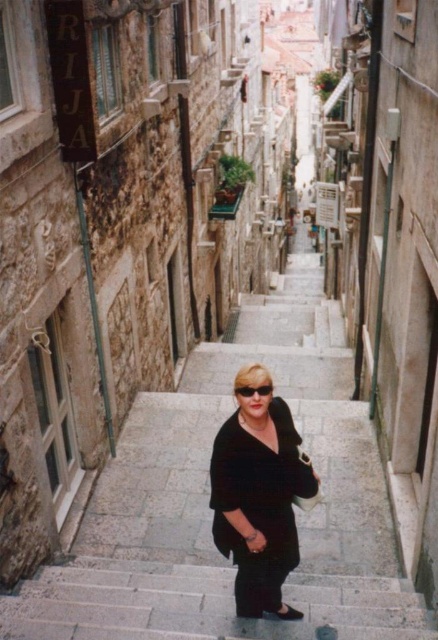
Between smooth stone stairs at center and black leather sandal at center, which one is positioned higher?

smooth stone stairs at center

Is smooth stone stairs at center below black leather sandal at center?

Incorrect, smooth stone stairs at center is not positioned below black leather sandal at center.

The height and width of the screenshot is (640, 438). I want to click on smooth stone stairs at center, so click(208, 500).

Who is positioned more to the right, black leather sandal at center or black matte sunglasses at center?

From the viewer's perspective, black leather sandal at center appears more on the right side.

Is black leather sandal at center above black matte sunglasses at center?

No, black leather sandal at center is not above black matte sunglasses at center.

The image size is (438, 640). What are the coordinates of `black leather sandal at center` in the screenshot? It's located at (282, 612).

The width and height of the screenshot is (438, 640). Identify the location of black leather sandal at center. (282, 612).

Can you confirm if stone stairs at center is positioned above black matte dress at center?

Incorrect, stone stairs at center is not positioned above black matte dress at center.

Does stone stairs at center have a greater width compared to black matte dress at center?

Indeed, stone stairs at center has a greater width compared to black matte dress at center.

The image size is (438, 640). In order to click on stone stairs at center in this screenshot , I will do `click(201, 604)`.